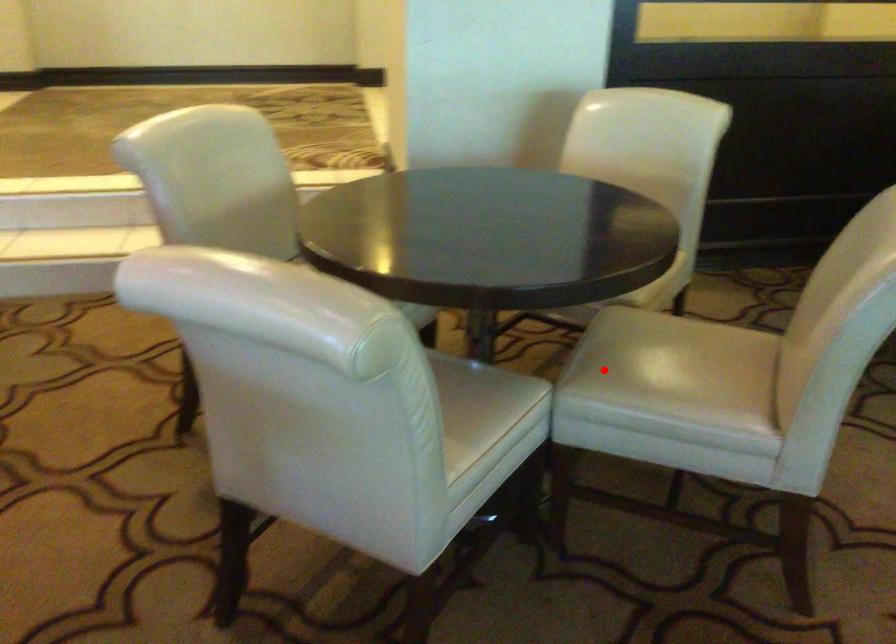
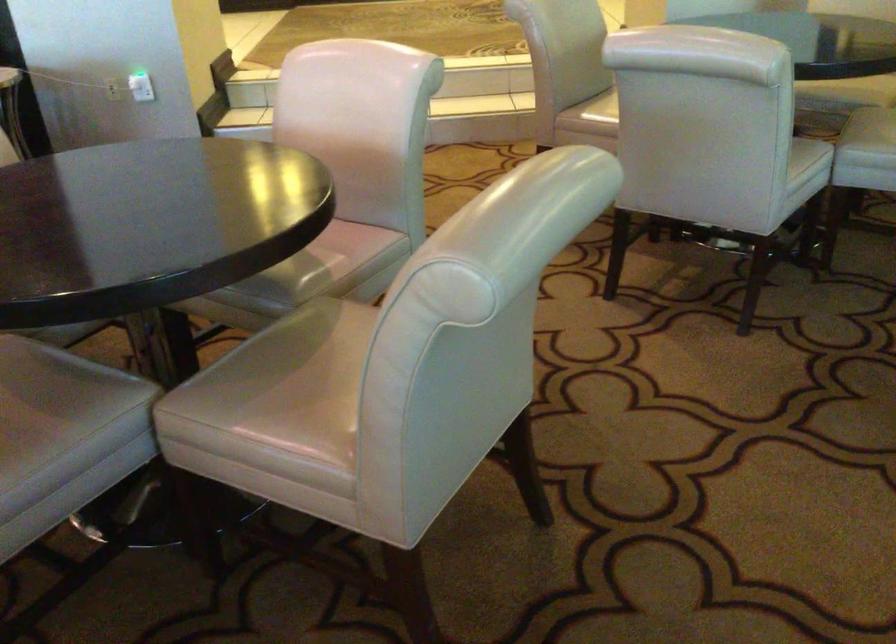
The point at the highlighted location is marked in the first image. Where is the corresponding point in the second image?

(874, 125)